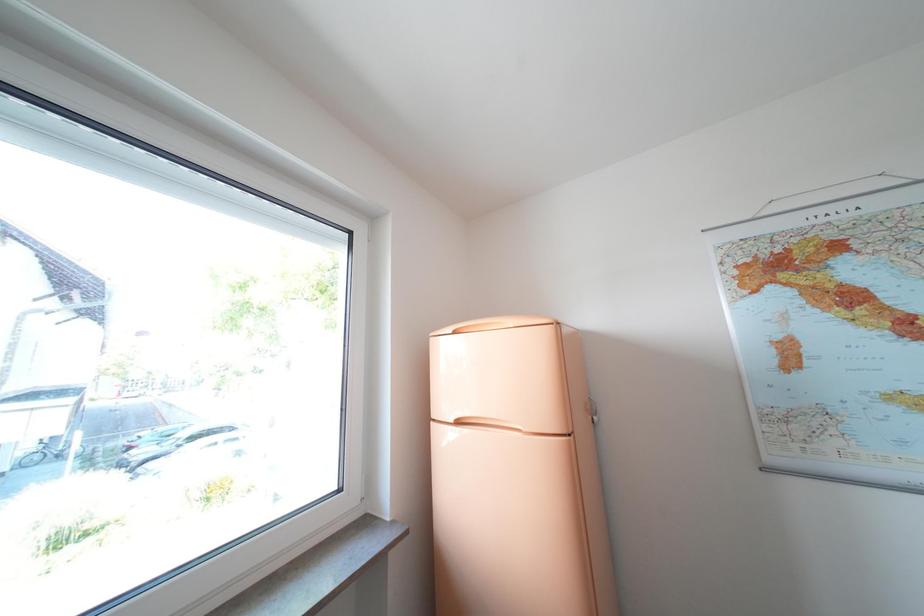
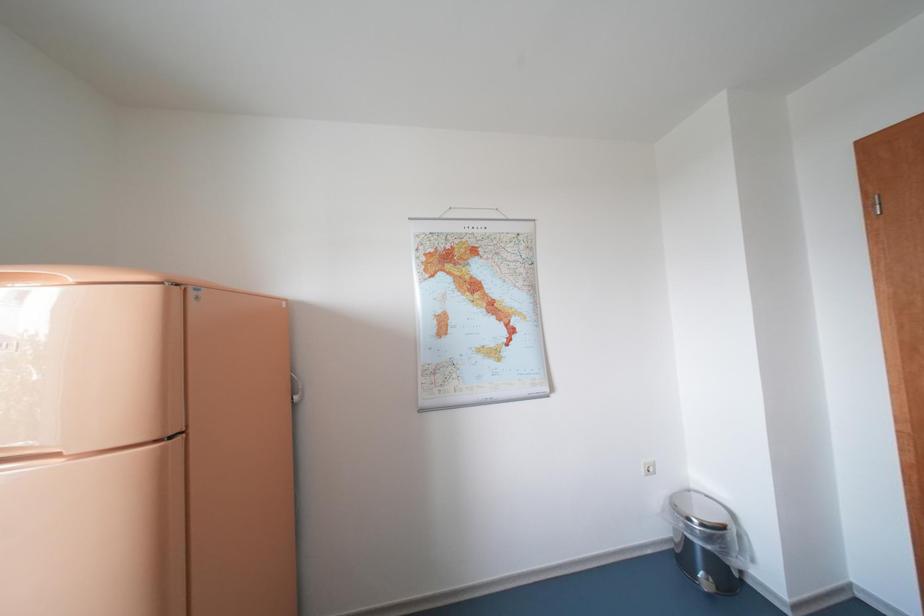
Question: The camera is either moving clockwise (left) or counter-clockwise (right) around the object. The first image is from the beginning of the video and the second image is from the end. Is the camera moving left or right when shooting the video?

Choices:
 (A) Left
 (B) Right

Answer: (A)